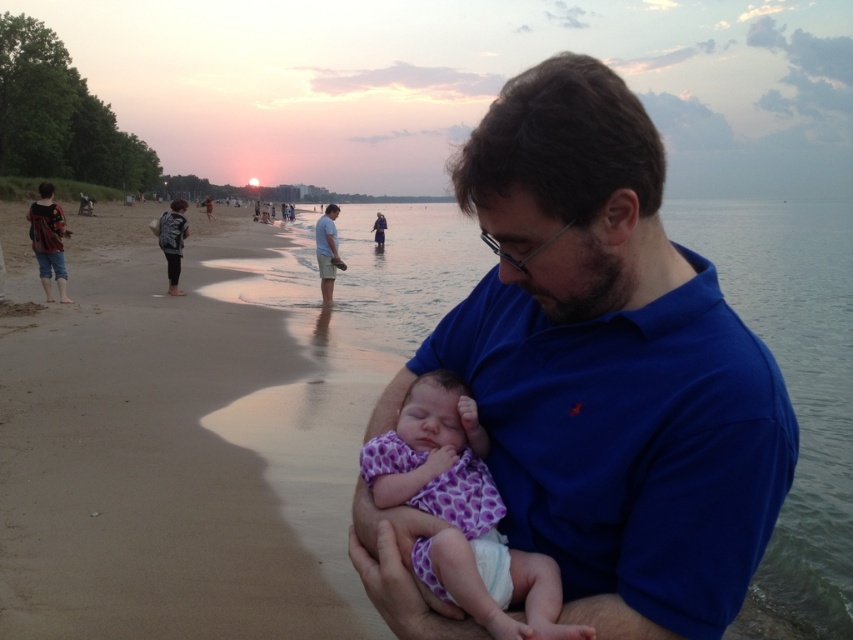
You are a photographer taking a picture of the serene beach scene. You notice the beige sand at center and the light blue cotton shirt at center. Which object is positioned to the right in the image?

The beige sand at center is to the right of the light blue cotton shirt at center, so the beige sand at center is positioned to the right.

You are a photographer trying to capture a photo of the sunset with the blue cotton shirt at center and the purple fabric baby at center in the foreground. Which object should you place closer to the left side of the frame to ensure the baby is centered in the photo?

The blue cotton shirt at center is positioned on the right side of purple fabric baby at center. To center the purple fabric baby at center, you should move the blue cotton shirt at center to the right, placing the purple fabric baby at center closer to the left side of the frame.